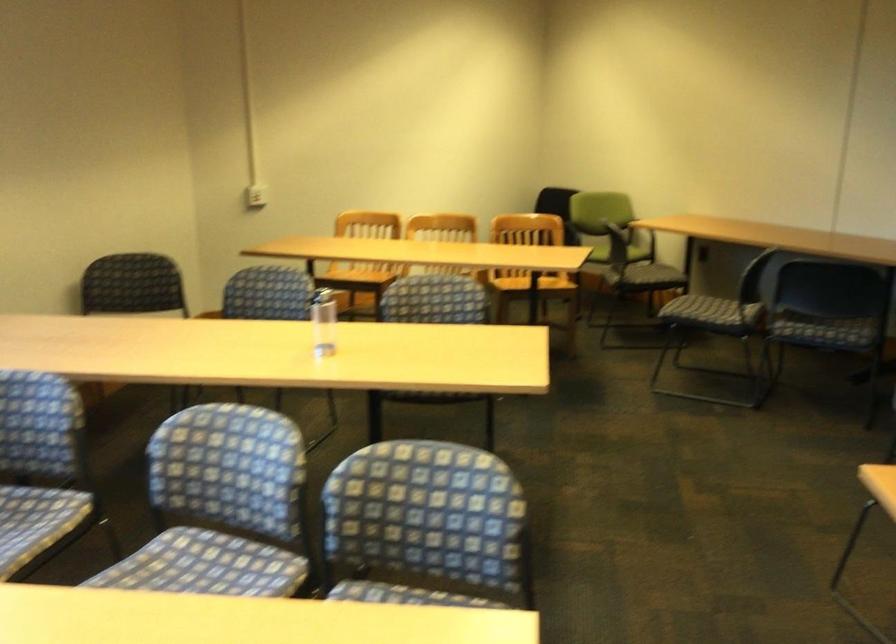
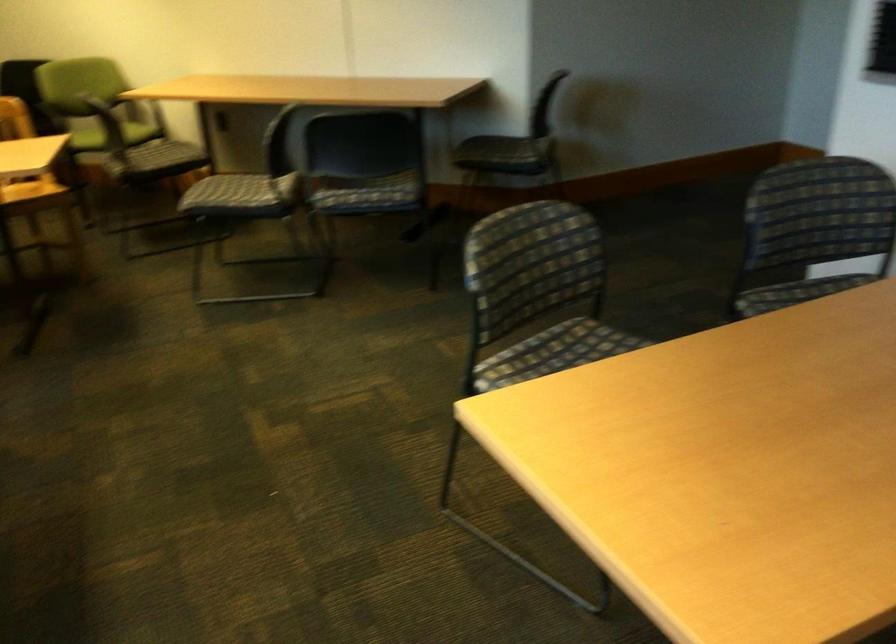
Question: How did the camera likely rotate?

Choices:
 (A) Left
 (B) Right
 (C) Up
 (D) Down

Answer: (B)